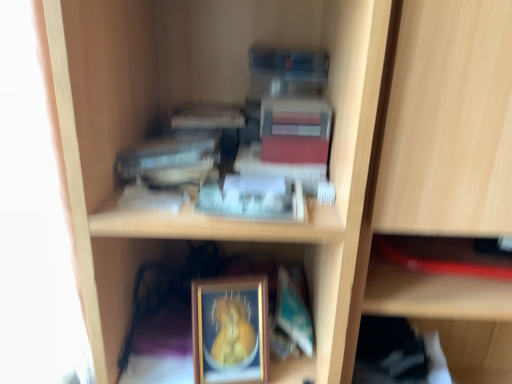
Question: In the image, is gold-framed picture at lower center positioned in front of or behind matte red paperback book at upper center, the 2th paperback book in the right-to-left sequence?

Choices:
 (A) front
 (B) behind

Answer: (B)

Question: Is point (216, 342) positioned closer to the camera than point (292, 135)?

Choices:
 (A) closer
 (B) farther

Answer: (B)

Question: Which object is positioned farthest from the teal matte paperback book at lower center, which is counted as the 3th paperback book, starting from the top?

Choices:
 (A) hardcover book at upper center, acting as the first paperback book starting from the left
 (B) matte red paperback book at upper center, arranged as the 3th paperback book when ordered from the bottom
 (C) gold-framed picture at lower center

Answer: (A)

Question: Which object is positioned farthest from the hardcover book at upper center, marked as the third paperback book in a right-to-left arrangement?

Choices:
 (A) gold-framed picture at lower center
 (B) teal matte paperback book at lower center, which appears as the first paperback book when ordered from the bottom
 (C) matte red paperback book at upper center, the 2th paperback book in the right-to-left sequence

Answer: (B)